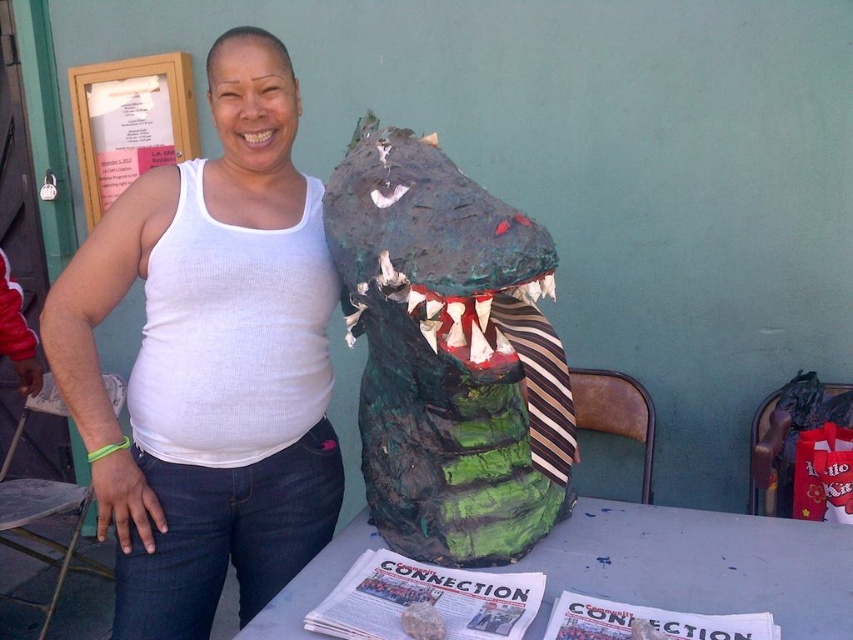
Does white fabric tank top at center have a greater height compared to wooden frame at upper left?

Yes, white fabric tank top at center is taller than wooden frame at upper left.

Can you confirm if white fabric tank top at center is positioned above wooden frame at upper left?

No, white fabric tank top at center is not above wooden frame at upper left.

Between point (177, 580) and point (115, 80), which one is positioned in front?

Point (177, 580) is in front.

Find the location of a particular element. white fabric tank top at center is located at coordinates (210, 362).

Does green papier-mâché crocodile at center appear under white paper at center?

No.

Who is lower down, green papier-mâché crocodile at center or white paper at center?

white paper at center is lower down.

Between point (467, 529) and point (576, 564), which one is positioned in front?

Positioned in front is point (576, 564).

At what (x,y) coordinates should I click in order to perform the action: click on green papier-mâché crocodile at center. Please return your answer as a coordinate pair (x, y). The width and height of the screenshot is (853, 640). Looking at the image, I should click on (450, 353).

Is point (671, 582) positioned in front of point (91, 193)?

Yes, point (671, 582) is closer to viewer.

Is white paper at center behind wooden frame at upper left?

No.

In order to click on white paper at center in this screenshot , I will do `click(701, 564)`.